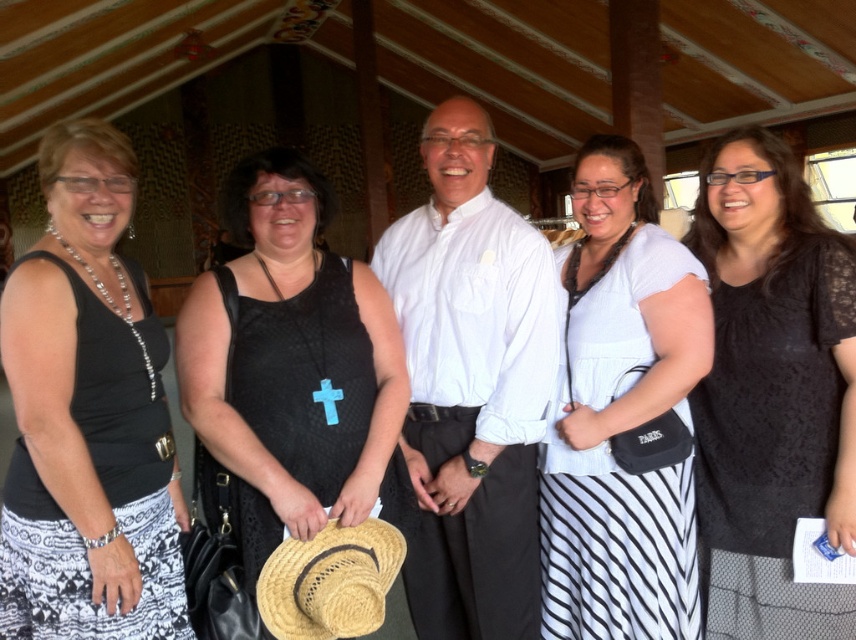
You are a photographer trying to capture a photo of the group. You notice the white striped skirt at center and the straw hat at center. Which object is more to the left in the image?

The straw hat at center is more to the left because the white striped skirt at center is positioned on the right side of the straw hat at center.

You are a photographer trying to capture a photo of the group. You want to ensure that the black mesh dress at center and the white striped skirt at center are both visible in the frame. Based on their positions, which one should you focus on first to ensure they are both in the shot?

The black mesh dress at center is to the left of white striped skirt at center, so you should focus on the white striped skirt at center first as it is further to the right, ensuring both are within the frame by starting from the right side.